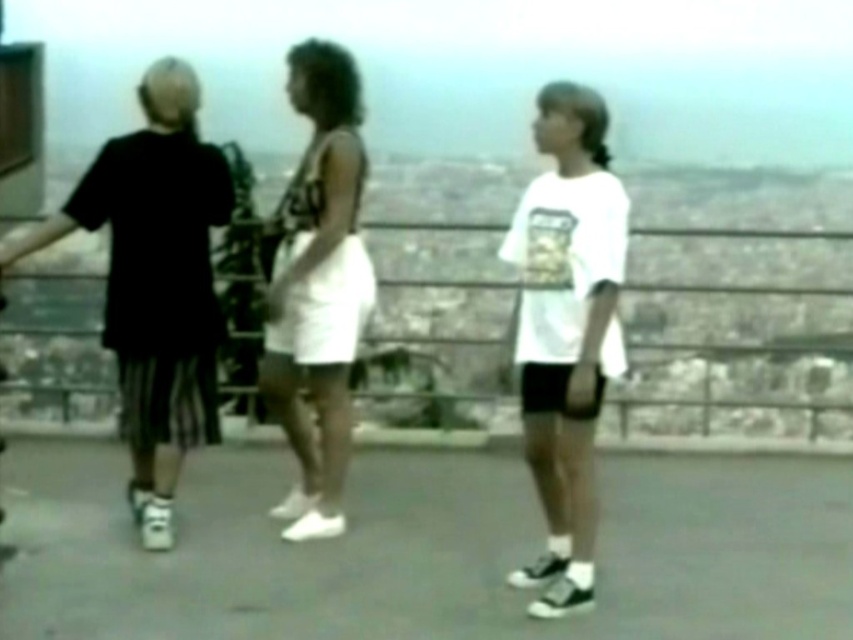
In the scene shown: Is black cotton shorts at left above white matte skirt at center?

No.

How far apart are black cotton shorts at left and white matte skirt at center?

A distance of 21.57 inches exists between black cotton shorts at left and white matte skirt at center.

Where is `black cotton shorts at left`? The width and height of the screenshot is (853, 640). black cotton shorts at left is located at coordinates (155, 282).

The image size is (853, 640). I want to click on black cotton shorts at left, so click(155, 282).

Does point (123, 147) come farther from viewer compared to point (535, 248)?

That is True.

Is black cotton shorts at left shorter than white matte t-shirt at center?

In fact, black cotton shorts at left may be taller than white matte t-shirt at center.

Identify the location of black cotton shorts at left. The width and height of the screenshot is (853, 640). (155, 282).

The image size is (853, 640). In order to click on black cotton shorts at left in this screenshot , I will do `click(155, 282)`.

Can you confirm if white matte t-shirt at center is positioned above white matte skirt at center?

Actually, white matte t-shirt at center is below white matte skirt at center.

Can you confirm if white matte t-shirt at center is positioned below white matte skirt at center?

Yes.

Between point (543, 176) and point (345, 234), which one is positioned behind?

The point (345, 234) is behind.

Image resolution: width=853 pixels, height=640 pixels. I want to click on white matte t-shirt at center, so click(x=566, y=330).